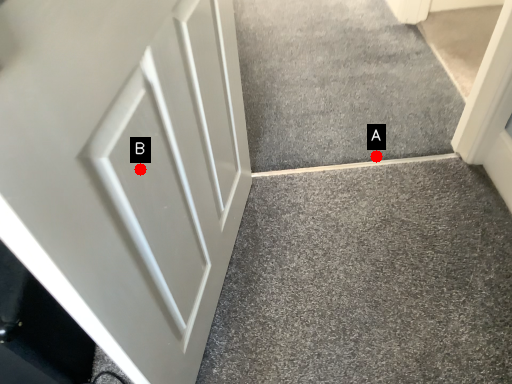
Question: Two points are circled on the image, labeled by A and B beside each circle. Which point appears closest to the camera in this image?

Choices:
 (A) A is closer
 (B) B is closer

Answer: (B)